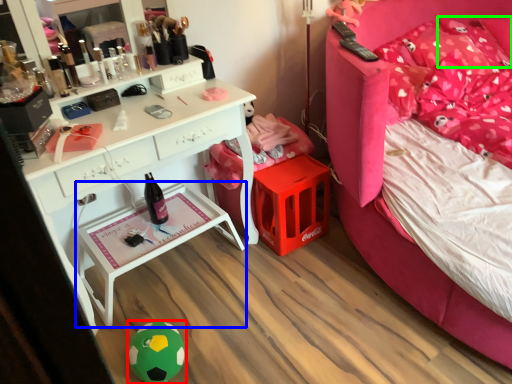
Question: Estimate the real-world distances between objects in this image. Which object is closer to toy (highlighted by a red box), nightstand (highlighted by a blue box) or pillow (highlighted by a green box)?

Choices:
 (A) nightstand
 (B) pillow

Answer: (A)